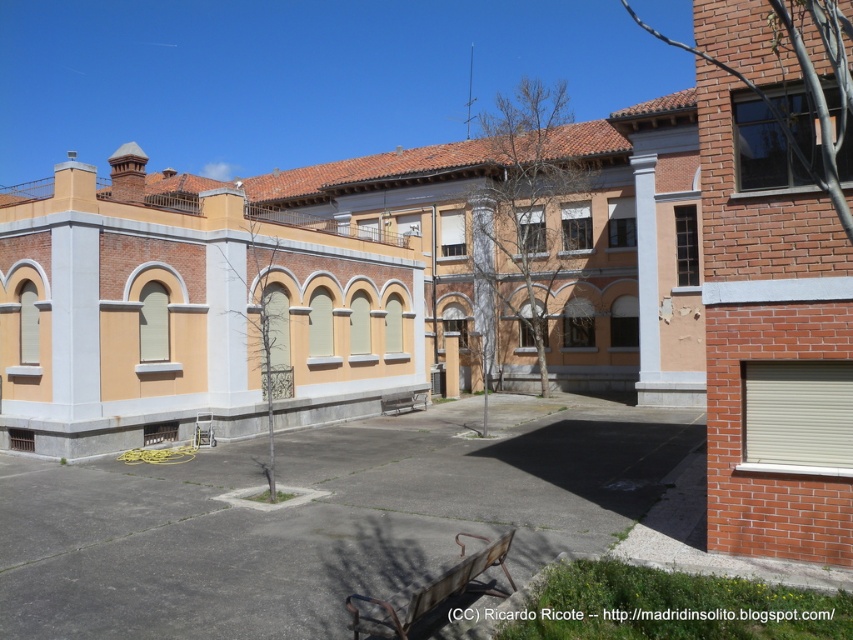
Which of these two, rustic wood park bench at lower center or metallic silver bench at center, stands taller?

With more height is rustic wood park bench at lower center.

I want to click on rustic wood park bench at lower center, so click(431, 589).